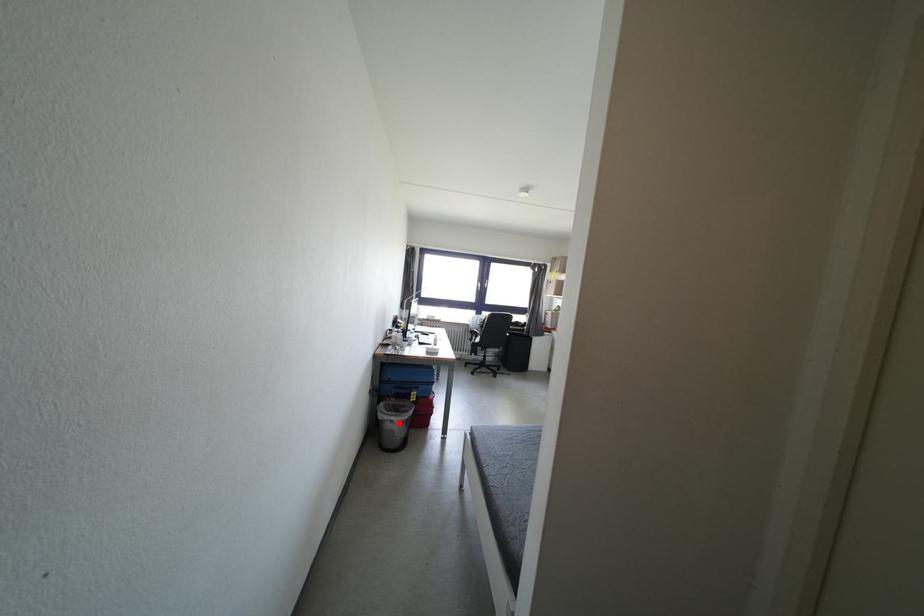
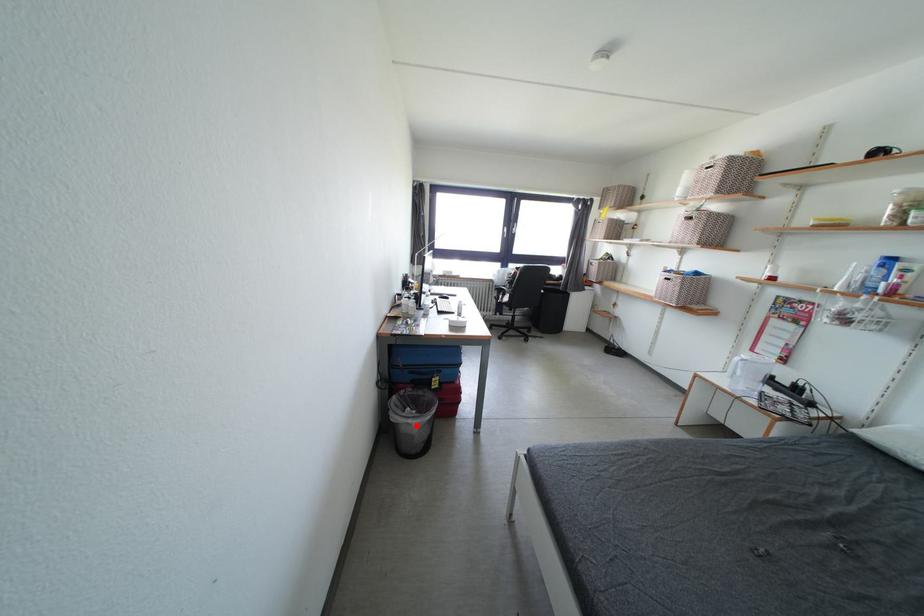
I am providing you with two images of the same scene from different viewpoints. A red point is marked on the first image and another point is marked on the second image. Is the red point in image1 aligned with the point shown in image2?

Yes